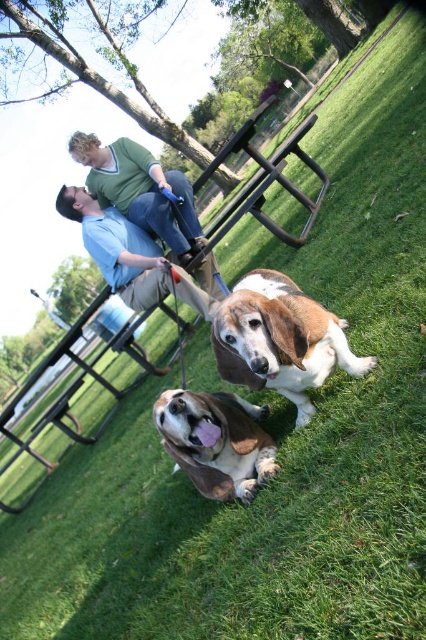
Question: Which object is closer to the camera taking this photo?

Choices:
 (A) brown furry dog at lower center
 (B) brown and white fur dog at center

Answer: (B)

Question: In this image, where is brown furry dog at lower center located relative to blue cotton shirt at upper center?

Choices:
 (A) above
 (B) below

Answer: (B)

Question: Is brown furry dog at lower center wider than blue cotton shirt at upper center?

Choices:
 (A) yes
 (B) no

Answer: (B)

Question: In this image, where is brown and white fur dog at center located relative to blue cotton shirt at upper center?

Choices:
 (A) right
 (B) left

Answer: (A)

Question: Among these objects, which one is nearest to the camera?

Choices:
 (A) brown furry dog at lower center
 (B) brown and white fur dog at center

Answer: (B)

Question: Which object appears closest to the camera in this image?

Choices:
 (A) blue cotton shirt at upper center
 (B) brown and white fur dog at center
 (C) brown furry dog at lower center

Answer: (B)